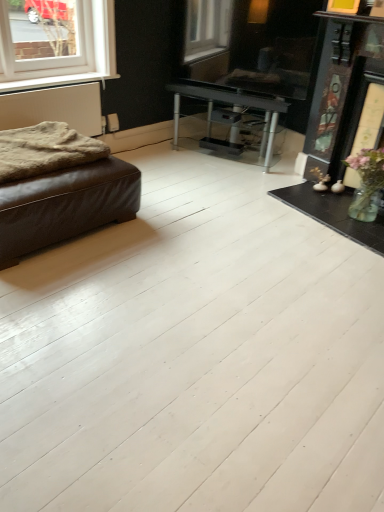
Question: In the image, is white matte window sill at upper left on the left side or the right side of fuzzy woolen blanket at left?

Choices:
 (A) left
 (B) right

Answer: (A)

Question: From the image's perspective, is white matte window sill at upper left located above or below fuzzy woolen blanket at left?

Choices:
 (A) above
 (B) below

Answer: (A)

Question: Which of these objects is positioned closest to the fuzzy woolen blanket at left?

Choices:
 (A) white matte window sill at upper left
 (B) brown leather ottoman at left
 (C) white textured radiator at left
 (D) white plastic window at upper left

Answer: (B)

Question: Estimate the real-world distances between objects in this image. Which object is farther from the white plastic window at upper left?

Choices:
 (A) fuzzy woolen blanket at left
 (B) white textured radiator at left
 (C) brown leather ottoman at left
 (D) white matte window sill at upper left

Answer: (C)